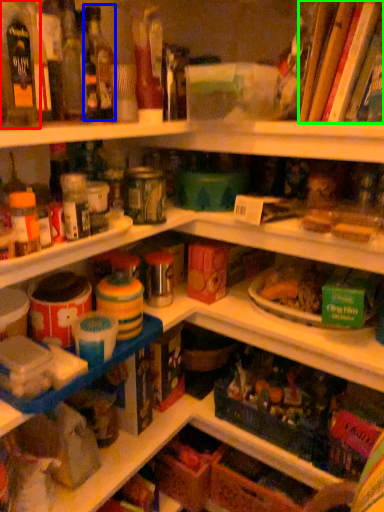
Question: Which object is the farthest from bottle (highlighted by a red box)? Choose among these: bottle (highlighted by a blue box) or book (highlighted by a green box).

Choices:
 (A) bottle
 (B) book

Answer: (B)